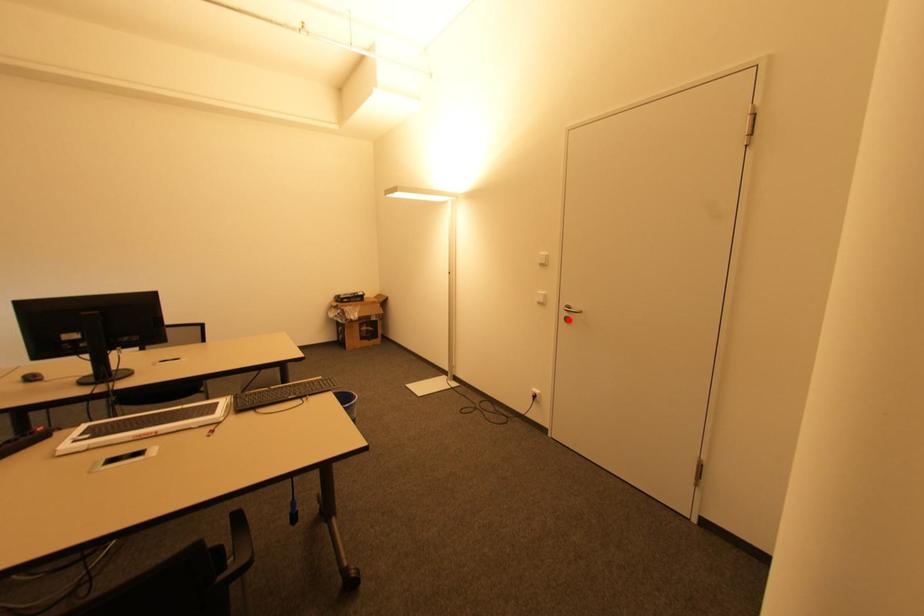
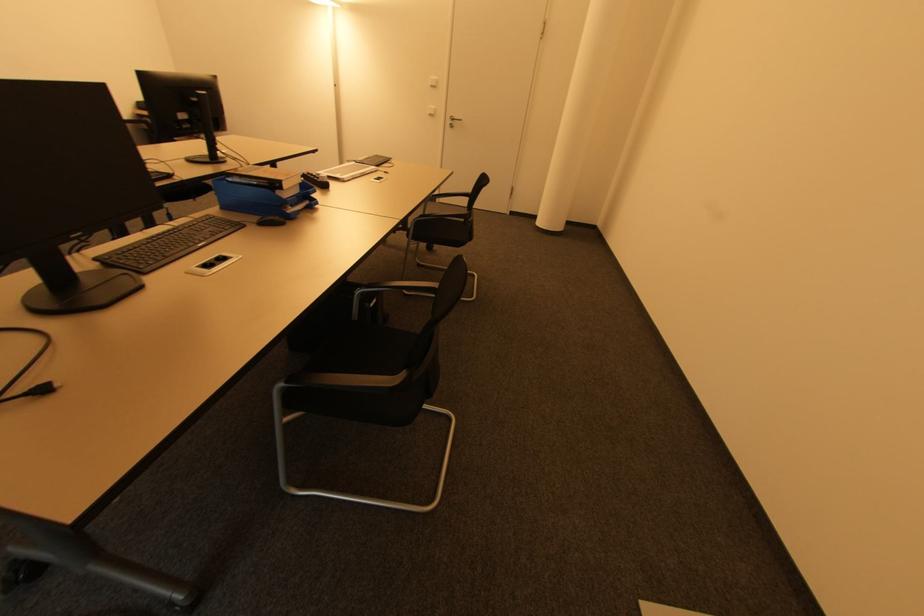
Where in the second image is the point corresponding to the highlighted location from the first image?

(454, 127)